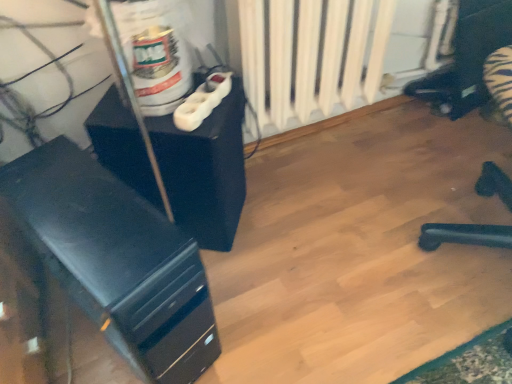
At what (x,y) coordinates should I click in order to perform the action: click on vacant space to the right of black matte computer tower at left, which ranks as the 1th furniture in bottom-to-top order. Please return your answer as a coordinate pair (x, y). Looking at the image, I should click on (279, 292).